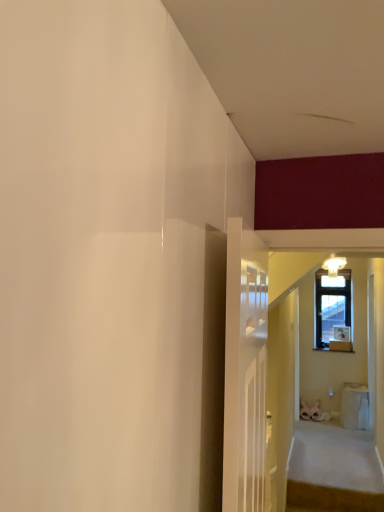
The width and height of the screenshot is (384, 512). What do you see at coordinates (334, 265) in the screenshot? I see `matte white chandelier at upper center` at bounding box center [334, 265].

Measure the distance between point (343, 260) and camera.

The distance of point (343, 260) from camera is 4.11 meters.

Image resolution: width=384 pixels, height=512 pixels. Find the location of `matte white chandelier at upper center`. matte white chandelier at upper center is located at coordinates (334, 265).

The image size is (384, 512). What are the coordinates of `matte white chandelier at upper center` in the screenshot? It's located at (x=334, y=265).